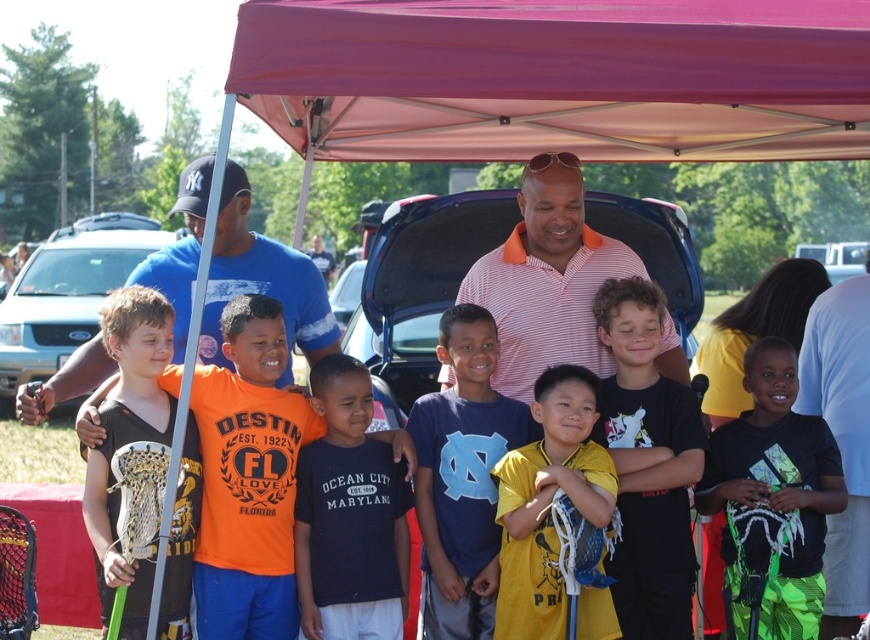
Does matte black lacrosse stick at center appear under yellow matte shirt at center?

No, matte black lacrosse stick at center is not below yellow matte shirt at center.

Is matte black lacrosse stick at center smaller than yellow matte shirt at center?

No, matte black lacrosse stick at center is not smaller than yellow matte shirt at center.

Locate an element on the screen. matte black lacrosse stick at center is located at coordinates (248, 477).

Which is more to the left, pink fabric canopy at upper center or black matte shirt at center?

Positioned to the left is pink fabric canopy at upper center.

The width and height of the screenshot is (870, 640). Find the location of `pink fabric canopy at upper center`. pink fabric canopy at upper center is located at coordinates (557, 77).

In order to click on pink fabric canopy at upper center in this screenshot , I will do `click(557, 77)`.

Between matte black lacrosse stick at center and matte black lacrosse stick at left, which one appears on the left side from the viewer's perspective?

matte black lacrosse stick at left is more to the left.

Who is positioned more to the right, matte black lacrosse stick at center or matte black lacrosse stick at left?

From the viewer's perspective, matte black lacrosse stick at center appears more on the right side.

The width and height of the screenshot is (870, 640). What do you see at coordinates (248, 477) in the screenshot?
I see `matte black lacrosse stick at center` at bounding box center [248, 477].

Identify the location of matte black lacrosse stick at center. (248, 477).